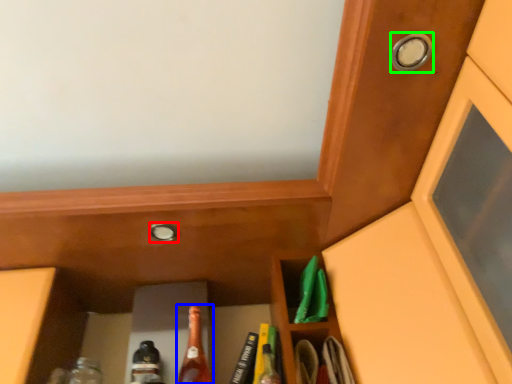
Question: Considering the real-world distances, which object is farthest from knob (highlighted by a red box)? beer bottle (highlighted by a blue box) or knob (highlighted by a green box)?

Choices:
 (A) beer bottle
 (B) knob

Answer: (B)